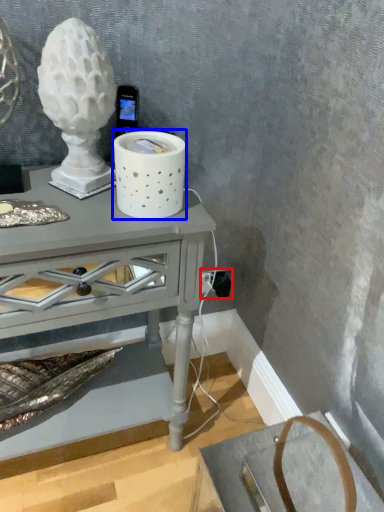
Question: Which of the following is the farthest to the observer, electric outlet (highlighted by a red box) or candle holder (highlighted by a blue box)?

Choices:
 (A) electric outlet
 (B) candle holder

Answer: (A)